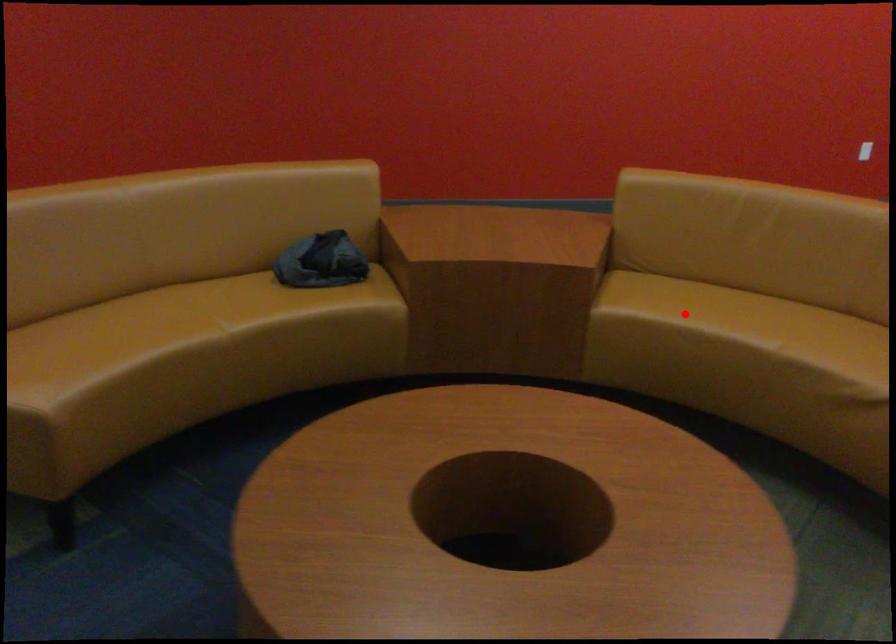
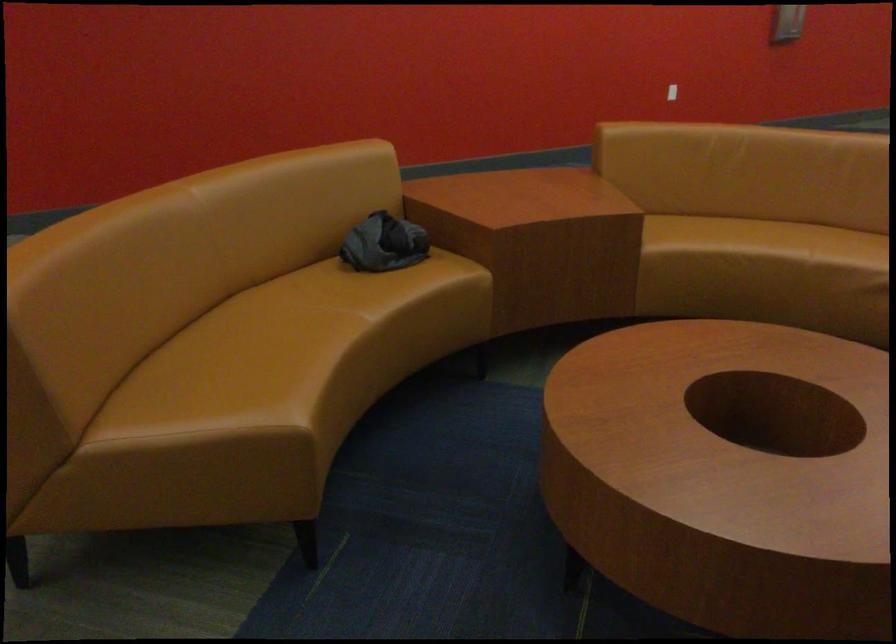
Locate, in the second image, the point that corresponds to the highlighted location in the first image.

(719, 242)